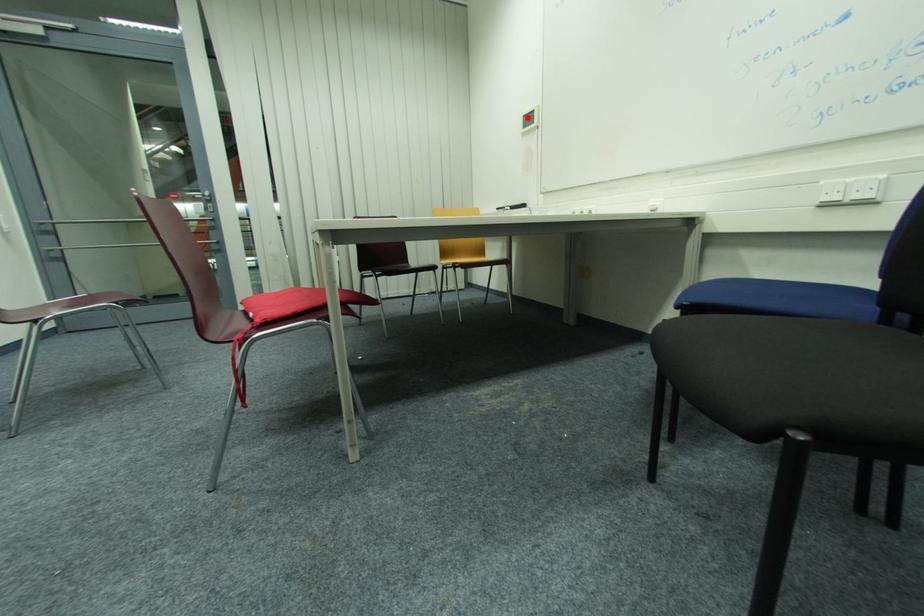
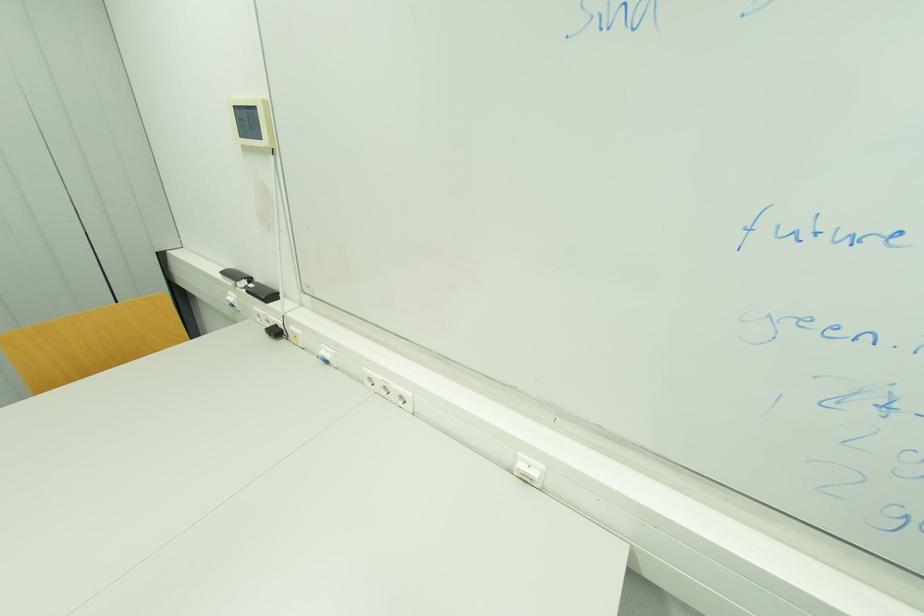
In the second image, find the point that corresponds to the highlighted location in the first image.

(237, 108)